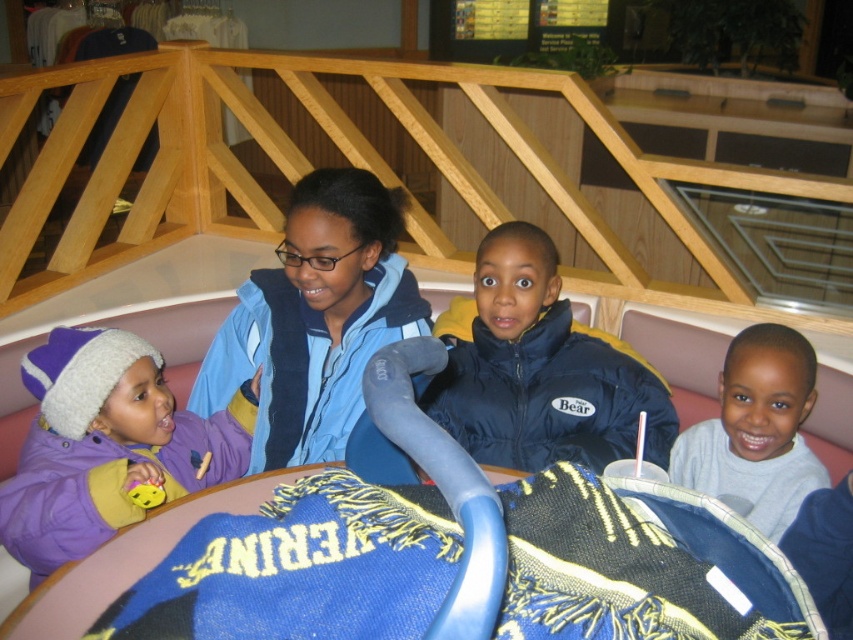
Question: Observing the image, what is the correct spatial positioning of navy blue puffer jacket at center in reference to purple fleece jacket at left?

Choices:
 (A) right
 (B) left

Answer: (A)

Question: Considering the relative positions of navy blue puffer jacket at center and purple fleece jacket at left in the image provided, where is navy blue puffer jacket at center located with respect to purple fleece jacket at left?

Choices:
 (A) above
 (B) below

Answer: (A)

Question: Among these objects, which one is nearest to the camera?

Choices:
 (A) purple fleece jacket at left
 (B) gray cotton shirt at lower right

Answer: (A)

Question: Can you confirm if purple fleece jacket at left is thinner than gray cotton shirt at lower right?

Choices:
 (A) no
 (B) yes

Answer: (A)

Question: Among these objects, which one is nearest to the camera?

Choices:
 (A) purple fleece jacket at left
 (B) gray cotton shirt at lower right
 (C) navy blue puffer jacket at center

Answer: (A)

Question: Which object appears farthest from the camera in this image?

Choices:
 (A) navy blue puffer jacket at center
 (B) purple fleece jacket at left

Answer: (A)